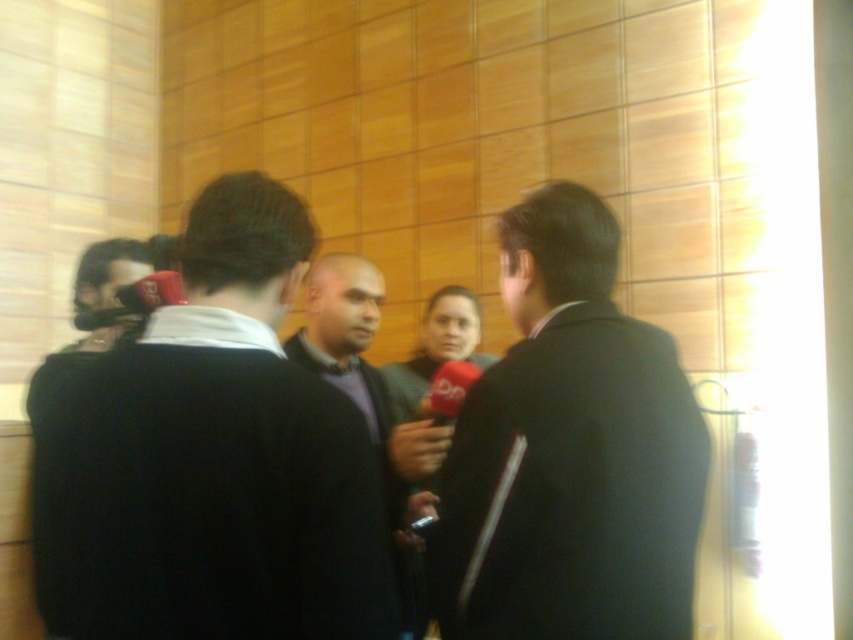
Question: Which point is closer to the camera?

Choices:
 (A) (100, 259)
 (B) (234, 515)
 (C) (447, 584)
 (D) (418, 440)

Answer: (B)

Question: Which object is the closest to the matte black camera at left?

Choices:
 (A) dark suit jacket at center
 (B) dark gray sweater at center

Answer: (B)

Question: Can you confirm if dark suit jacket at center is positioned to the left of matte black camera at left?

Choices:
 (A) no
 (B) yes

Answer: (A)

Question: Does dark gray sweater at center have a greater width compared to dark suit jacket at center?

Choices:
 (A) yes
 (B) no

Answer: (A)

Question: Does dark gray sweater at center appear on the right side of dark suit jacket at center?

Choices:
 (A) no
 (B) yes

Answer: (A)

Question: Estimate the real-world distances between objects in this image. Which object is farther from the matte black camera at left?

Choices:
 (A) dark suit jacket at center
 (B) dark gray sweater at center

Answer: (A)